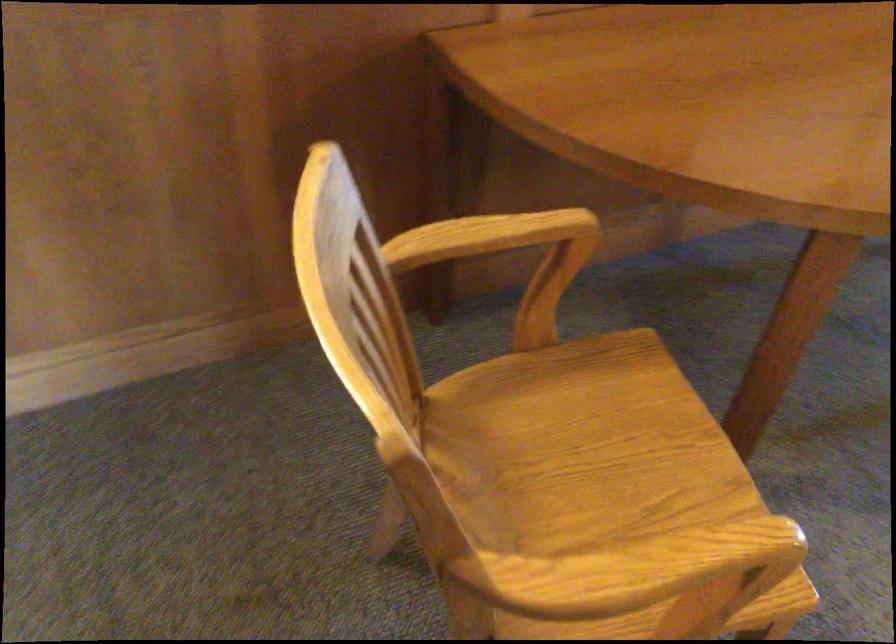
Image resolution: width=896 pixels, height=644 pixels. Find the location of `chair sitting surface`. chair sitting surface is located at coordinates (574, 456).